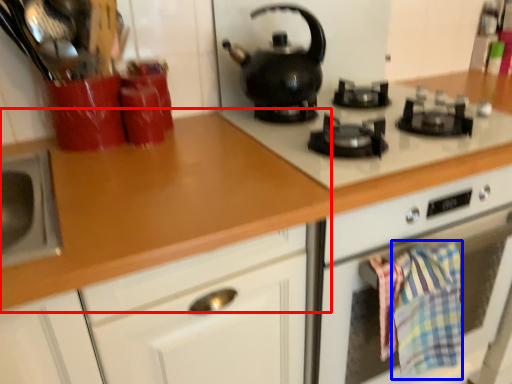
Question: Which object is closer to the camera taking this photo, countertop (highlighted by a red box) or blanket (highlighted by a blue box)?

Choices:
 (A) countertop
 (B) blanket

Answer: (A)